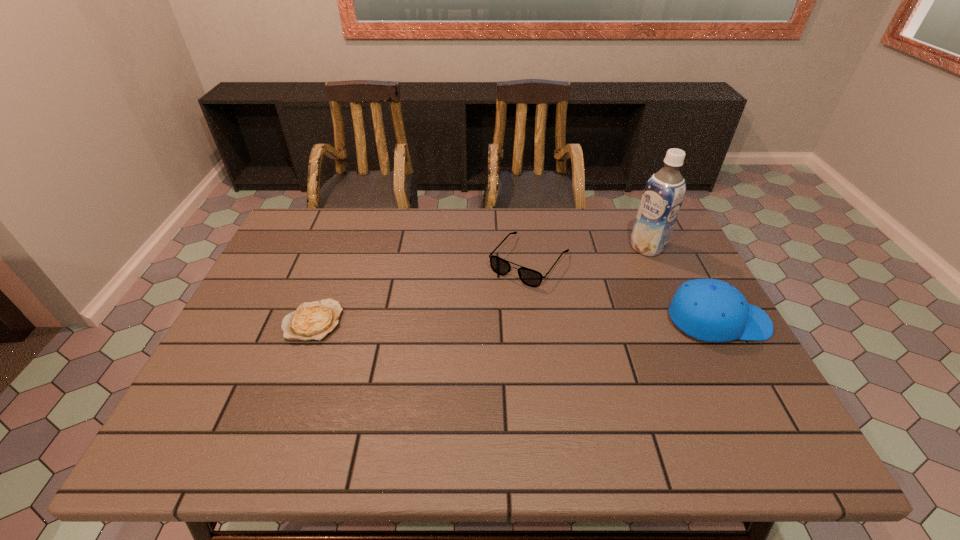
Locate an element on the screen. vacant region that satisfies the following two spatial constraints: 1. on the front side of the third shortest object; 2. on the front-facing side of the tallest object is located at coordinates (681, 321).

I want to click on vacant region that satisfies the following two spatial constraints: 1. on the front side of the cap; 2. on the front-facing side of the tallest object, so click(x=681, y=321).